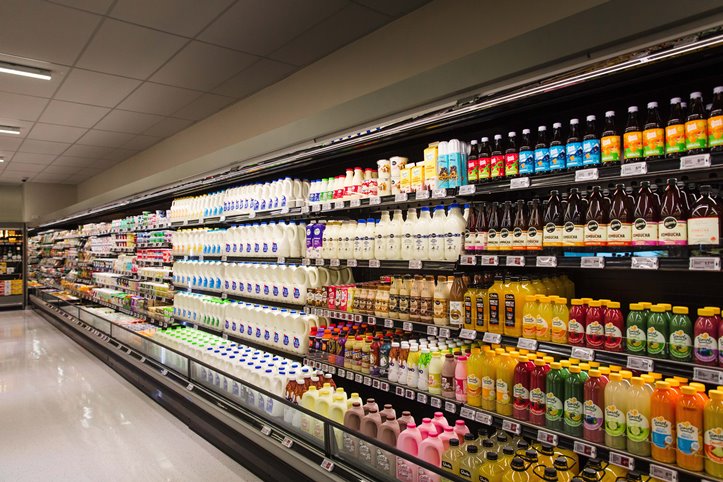
Where is `lights`? The height and width of the screenshot is (482, 723). lights is located at coordinates 14,69, 9,128, 4,157.